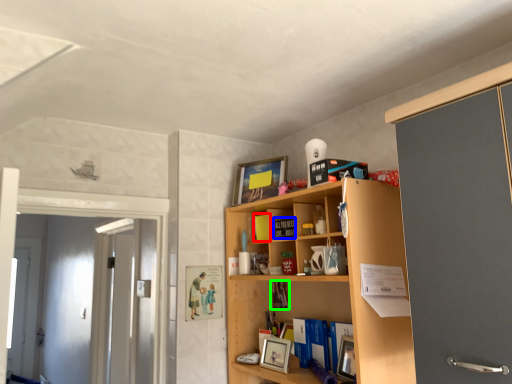
Question: Estimate the real-world distances between objects in this image. Which object is closer to book (highlighted by a red box), book (highlighted by a blue box) or book (highlighted by a green box)?

Choices:
 (A) book
 (B) book

Answer: (A)